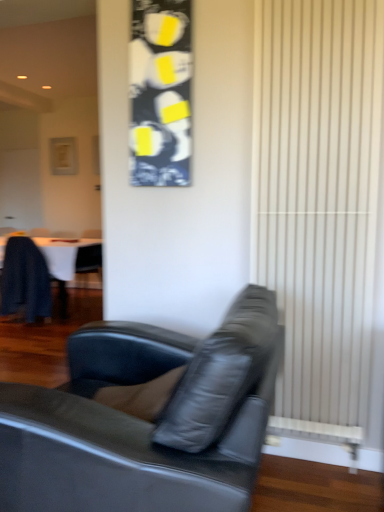
Question: From a real-world perspective, is dark blue leather chair at left on dark wood table at left?

Choices:
 (A) no
 (B) yes

Answer: (B)

Question: Could dark wood table at left be considered to be inside dark blue leather chair at left?

Choices:
 (A) yes
 (B) no

Answer: (B)

Question: Does dark blue leather chair at left come behind dark wood table at left?

Choices:
 (A) yes
 (B) no

Answer: (B)

Question: Considering the relative sizes of dark blue leather chair at left and dark wood table at left in the image provided, is dark blue leather chair at left bigger than dark wood table at left?

Choices:
 (A) no
 (B) yes

Answer: (A)

Question: Is dark blue leather chair at left not within dark wood table at left?

Choices:
 (A) yes
 (B) no

Answer: (A)

Question: Is dark wood table at left in front of or behind black leather couch at center in the image?

Choices:
 (A) front
 (B) behind

Answer: (B)

Question: Is point (13, 283) closer or farther from the camera than point (19, 406)?

Choices:
 (A) closer
 (B) farther

Answer: (B)

Question: From the image's perspective, is dark wood table at left above or below black leather couch at center?

Choices:
 (A) below
 (B) above

Answer: (B)

Question: From a real-world perspective, is dark wood table at left physically located above or below black leather couch at center?

Choices:
 (A) above
 (B) below

Answer: (B)

Question: Is black leather couch at center situated inside white textured radiator at right or outside?

Choices:
 (A) inside
 (B) outside

Answer: (B)

Question: From a real-world perspective, is black leather couch at center positioned above or below white textured radiator at right?

Choices:
 (A) above
 (B) below

Answer: (B)

Question: Is black leather couch at center wider or thinner than white textured radiator at right?

Choices:
 (A) wide
 (B) thin

Answer: (A)

Question: In terms of height, does black leather couch at center look taller or shorter compared to white textured radiator at right?

Choices:
 (A) short
 (B) tall

Answer: (A)

Question: Relative to dark wood table at left, is white textured radiator at right in front or behind?

Choices:
 (A) behind
 (B) front

Answer: (B)

Question: From the image's perspective, is white textured radiator at right located above or below dark wood table at left?

Choices:
 (A) above
 (B) below

Answer: (A)